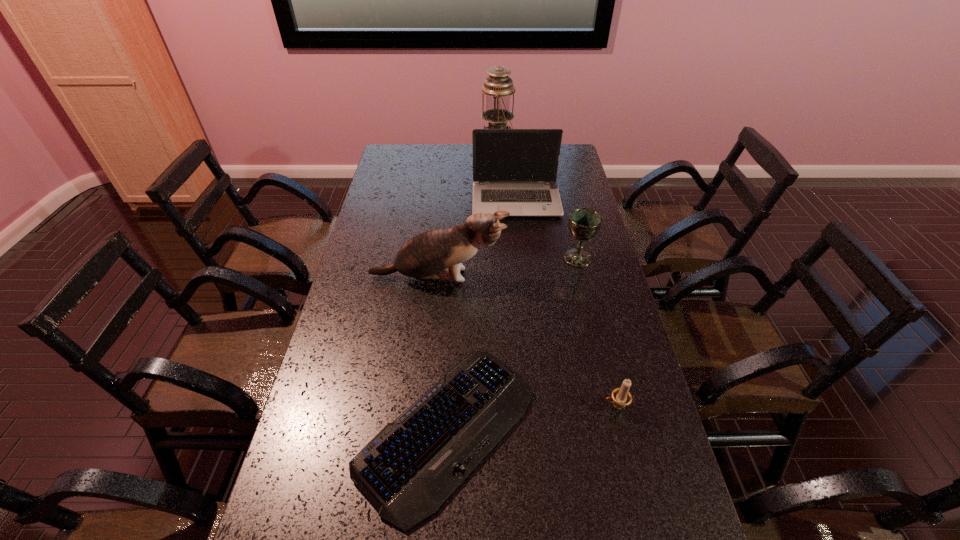
At what (x,y) coordinates should I click in order to perform the action: click on candle_holder that is at the right edge. Please return your answer as a coordinate pair (x, y). The height and width of the screenshot is (540, 960). Looking at the image, I should click on (621, 397).

Where is `free region at the far edge`? free region at the far edge is located at coordinates (441, 164).

Identify the location of vacant area at the left edge of the desktop. The width and height of the screenshot is (960, 540). (359, 372).

I want to click on vacant region at the right edge, so click(x=638, y=408).

Where is `free space between the chalice and the candle_holder`? free space between the chalice and the candle_holder is located at coordinates (597, 332).

Where is `vacant area that lies between the oil lamp and the candle_holder`? vacant area that lies between the oil lamp and the candle_holder is located at coordinates (557, 279).

Where is `blank region between the second farthest object and the candle_holder`? This screenshot has width=960, height=540. blank region between the second farthest object and the candle_holder is located at coordinates (565, 303).

At what (x,y) coordinates should I click in order to perform the action: click on vacant point located between the cat and the oil lamp. Please return your answer as a coordinate pair (x, y). Image resolution: width=960 pixels, height=540 pixels. Looking at the image, I should click on (468, 215).

Image resolution: width=960 pixels, height=540 pixels. What are the coordinates of `vacant point located between the shortest object and the candle_holder` in the screenshot? It's located at (532, 418).

This screenshot has height=540, width=960. Identify the location of vacant area that lies between the shortest object and the tallest object. (473, 291).